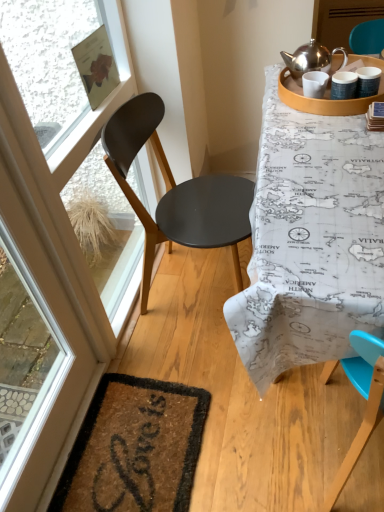
I want to click on vacant area on the back side of brown coir mat at lower left, so pyautogui.click(x=165, y=351).